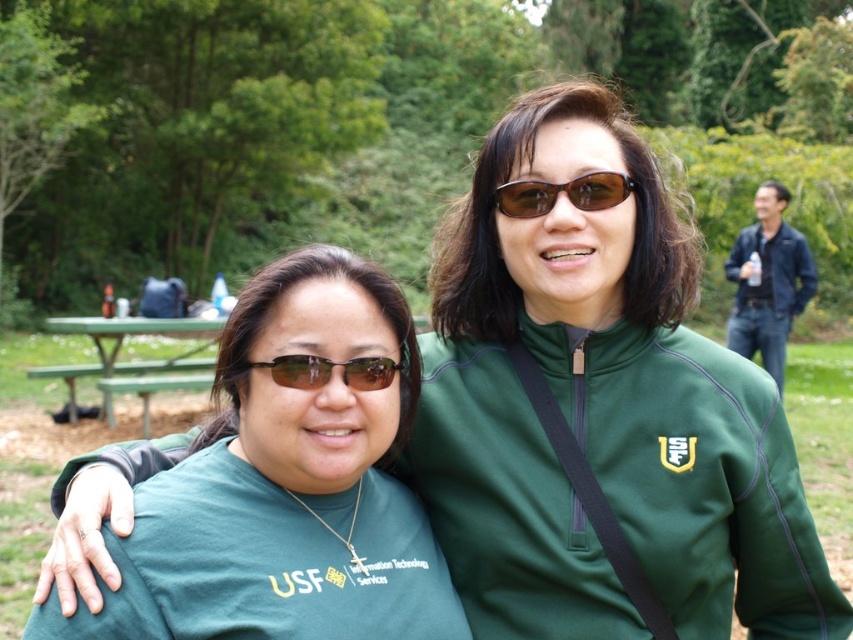
You are a photographer trying to capture a clear shot of the green matte shirt at center and the brown matte sunglasses at center. Which object should you focus on first to ensure both are in focus?

The green matte shirt at center is closer to the viewer than the brown matte sunglasses at center. To ensure both are in focus, you should focus on the green matte shirt at center first, as it is closer, and the depth of field will naturally include the sunglasses which are farther away.

You are a photographer setting up a tripod to take a group photo of the two people in the scene. The black leather jacket at upper right and the brown matte sunglasses at center are both in your viewfinder. Based on their sizes in the image, which object would appear larger in the final photo?

The black leather jacket at upper right appears much taller than the brown matte sunglasses at center, so it would look larger in the photo.

You are a photographer setting up for a group photo. You notice the black leather jacket at upper right and the brown matte sunglasses at center. Which object is positioned higher in the frame?

The black leather jacket at upper right is located above the brown matte sunglasses at center, so it is positioned higher in the frame.